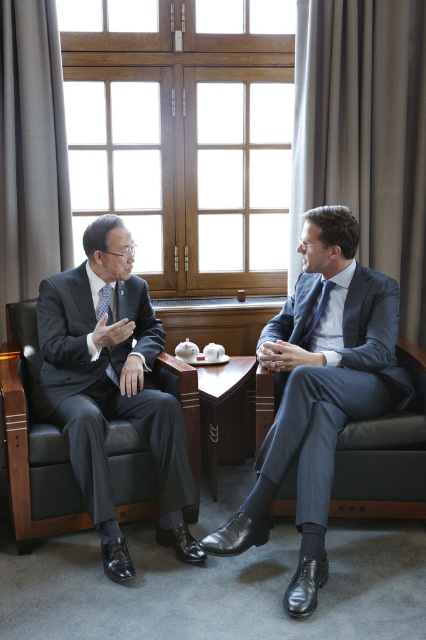
Question: Is dark blue fabric armchair at right smaller than matte blue tie at center?

Choices:
 (A) yes
 (B) no

Answer: (B)

Question: Which object is positioned closest to the wooden table at center?

Choices:
 (A) leather armchair at left
 (B) matte black tie at left
 (C) blue satin suit at center
 (D) matte blue tie at center

Answer: (A)

Question: Which object is farther from the camera taking this photo?

Choices:
 (A) matte blue tie at center
 (B) leather armchair at left
 (C) wooden table at center
 (D) blue satin suit at center

Answer: (A)

Question: Can you confirm if dark blue fabric armchair at right is bigger than wooden table at center?

Choices:
 (A) yes
 (B) no

Answer: (A)

Question: Is blue satin suit at center smaller than matte blue tie at center?

Choices:
 (A) yes
 (B) no

Answer: (B)

Question: Which point is farther from the camera taking this photo?

Choices:
 (A) (316, 305)
 (B) (414, 349)

Answer: (B)